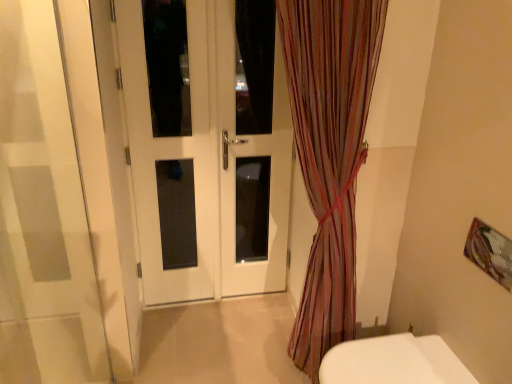
Identify the location of white glossy door at center. (205, 160).

Measure the distance between metallic silver picture frame at upper right and camera.

The distance of metallic silver picture frame at upper right from camera is 1.38 meters.

You are a GUI agent. You are given a task and a screenshot of the screen. Output one action in this format:
    pyautogui.click(x=<x>, y=<y>)
    Task: Click on the white glass door at center
    This screenshot has width=512, height=384.
    Given the screenshot: What is the action you would take?
    pyautogui.click(x=251, y=165)

Locate an element on the screen. Image resolution: width=512 pixels, height=384 pixels. white glossy door at center is located at coordinates (205, 160).

From the image's perspective, is metallic silver picture frame at upper right above or below white glass door at center?

metallic silver picture frame at upper right is below white glass door at center.

Between point (504, 277) and point (225, 126), which one is positioned in front?

The point (504, 277) is more forward.

Considering the relative positions of metallic silver picture frame at upper right and white glass door at center in the image provided, is metallic silver picture frame at upper right to the left of white glass door at center from the viewer's perspective?

No.

Does metallic silver picture frame at upper right touch white glass door at center?

No, metallic silver picture frame at upper right is not touching white glass door at center.

Relative to white glass door at center, is white glossy door at center in front or behind?

white glossy door at center is in front of white glass door at center.

Is point (174, 273) positioned in front of point (267, 18)?

No, it is behind (267, 18).

Considering the relative sizes of white glossy door at center and white glass door at center in the image provided, is white glossy door at center thinner than white glass door at center?

Yes, white glossy door at center is thinner than white glass door at center.

From the image's perspective, which one is positioned higher, white glossy door at center or white glass door at center?

white glossy door at center appears higher in the image.

Is point (426, 340) positioned after point (336, 16)?

Yes, it is behind point (336, 16).

Considering the sizes of objects white glossy toilet at lower right and striped sheer curtain at center in the image provided, who is shorter, white glossy toilet at lower right or striped sheer curtain at center?

Standing shorter between the two is white glossy toilet at lower right.

Consider the image. Is white glossy toilet at lower right facing away from striped sheer curtain at center?

white glossy toilet at lower right does not have its back to striped sheer curtain at center.

Considering the positions of objects white glossy toilet at lower right and striped sheer curtain at center in the image provided, who is more to the left, white glossy toilet at lower right or striped sheer curtain at center?

Positioned to the left is striped sheer curtain at center.

Is metallic silver picture frame at upper right to the left of striped sheer curtain at center from the viewer's perspective?

Incorrect, metallic silver picture frame at upper right is not on the left side of striped sheer curtain at center.

Looking at this image, between metallic silver picture frame at upper right and striped sheer curtain at center, which one has smaller size?

metallic silver picture frame at upper right is smaller.

From the image's perspective, is metallic silver picture frame at upper right above or below striped sheer curtain at center?

Based on their image positions, metallic silver picture frame at upper right is located beneath striped sheer curtain at center.

Does metallic silver picture frame at upper right turn towards white glossy toilet at lower right?

No, metallic silver picture frame at upper right does not turn towards white glossy toilet at lower right.

You are a GUI agent. You are given a task and a screenshot of the screen. Output one action in this format:
    pyautogui.click(x=<x>, y=<y>)
    Task: Click on the toilet behind the metallic silver picture frame at upper right
    
    Given the screenshot: What is the action you would take?
    pyautogui.click(x=394, y=362)

Based on the photo, from a real-world perspective, is metallic silver picture frame at upper right physically located above or below white glossy toilet at lower right?

metallic silver picture frame at upper right is above white glossy toilet at lower right.

Consider the image. Visually, is striped sheer curtain at center positioned to the left or to the right of white glossy door at center?

In the image, striped sheer curtain at center appears on the right side of white glossy door at center.

Is striped sheer curtain at center turned away from white glossy door at center?

No, striped sheer curtain at center is not facing away from white glossy door at center.

Is point (350, 47) positioned after point (138, 135)?

No, it is not.

Is striped sheer curtain at center spatially inside white glossy door at center, or outside of it?

striped sheer curtain at center exists outside the volume of white glossy door at center.

From their relative heights in the image, would you say white glossy toilet at lower right is taller or shorter than white glossy door at center?

Considering their sizes, white glossy toilet at lower right has less height than white glossy door at center.

Is white glossy toilet at lower right not within white glossy door at center?

white glossy toilet at lower right is positioned outside white glossy door at center.

Is white glossy toilet at lower right with white glossy door at center?

No, white glossy toilet at lower right is not in contact with white glossy door at center.

From the image's perspective, is white glossy toilet at lower right located above or below white glossy door at center?

Based on their image positions, white glossy toilet at lower right is located beneath white glossy door at center.

At what (x,y) coordinates should I click in order to perform the action: click on picture frame to the right of white glass door at center. Please return your answer as a coordinate pair (x, y). This screenshot has height=384, width=512. Looking at the image, I should click on [x=490, y=252].

You are a GUI agent. You are given a task and a screenshot of the screen. Output one action in this format:
    pyautogui.click(x=<x>, y=<y>)
    Task: Click on the screen door behind the white glossy door at center
    This screenshot has width=512, height=384.
    Given the screenshot: What is the action you would take?
    pyautogui.click(x=251, y=165)

Looking at the image, which one is located further to white glossy toilet at lower right, white glass door at center or white glossy door at center?

white glass door at center is further to white glossy toilet at lower right.

Estimate the real-world distances between objects in this image. Which object is further from white glossy toilet at lower right, metallic silver picture frame at upper right or striped sheer curtain at center?

striped sheer curtain at center is positioned further to the anchor white glossy toilet at lower right.

From the image, which object appears to be nearer to striped sheer curtain at center, metallic silver picture frame at upper right or white glossy door at center?

Based on the image, white glossy door at center appears to be nearer to striped sheer curtain at center.

Looking at the image, which one is located further to metallic silver picture frame at upper right, white glossy toilet at lower right or white glass door at center?

white glass door at center is positioned further to the anchor metallic silver picture frame at upper right.

Estimate the real-world distances between objects in this image. Which object is further from striped sheer curtain at center, metallic silver picture frame at upper right or white glossy toilet at lower right?

metallic silver picture frame at upper right.

Which object lies nearer to the anchor point white glossy door at center, white glass door at center or metallic silver picture frame at upper right?

white glass door at center is positioned closer to the anchor white glossy door at center.

Considering their positions, is white glossy toilet at lower right positioned closer to striped sheer curtain at center than white glossy door at center?

white glossy toilet at lower right lies closer to striped sheer curtain at center than the other object.

Based on their spatial positions, is white glossy door at center or metallic silver picture frame at upper right further from white glass door at center?

metallic silver picture frame at upper right lies further to white glass door at center than the other object.

Locate an element on the screen. Image resolution: width=512 pixels, height=384 pixels. screen door between white glossy door at center and metallic silver picture frame at upper right from left to right is located at coordinates (251, 165).

The height and width of the screenshot is (384, 512). In order to click on picture frame between striped sheer curtain at center and white glossy toilet at lower right in the up-down direction in this screenshot , I will do `click(490, 252)`.

The height and width of the screenshot is (384, 512). I want to click on picture frame between white glass door at center and white glossy toilet at lower right in the up-down direction, so click(490, 252).

I want to click on curtain between white glossy door at center and metallic silver picture frame at upper right, so click(329, 154).